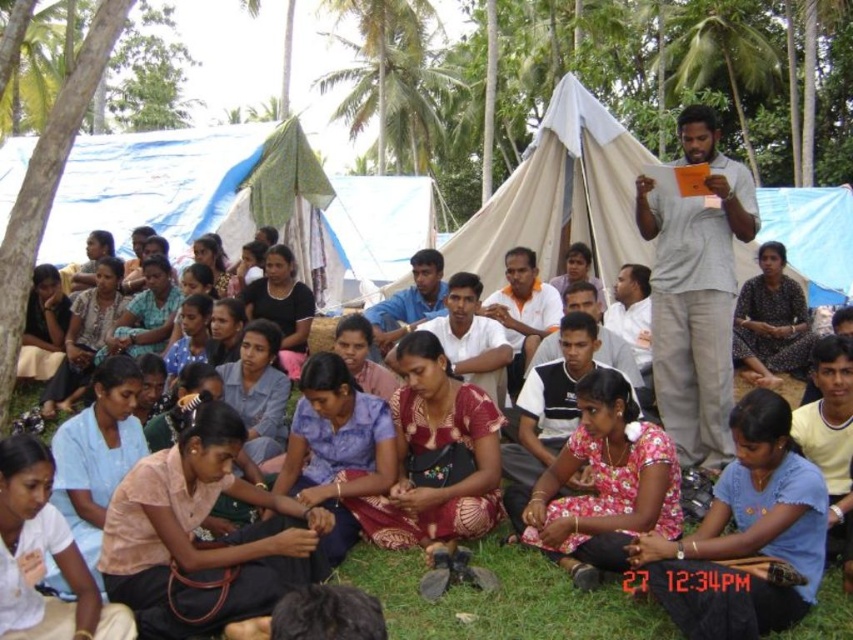
The width and height of the screenshot is (853, 640). What are the coordinates of `blue tarpaulin tent at upper left` in the screenshot? It's located at (201, 193).

Is blue tarpaulin tent at upper left smaller than white canvas tent at center?

Yes.

Is point (315, 243) closer to viewer compared to point (451, 253)?

No, (315, 243) is behind (451, 253).

You are a GUI agent. You are given a task and a screenshot of the screen. Output one action in this format:
    pyautogui.click(x=<x>, y=<y>)
    Task: Click on the blue tarpaulin tent at upper left
    The width and height of the screenshot is (853, 640).
    Given the screenshot: What is the action you would take?
    pyautogui.click(x=201, y=193)

Does point (608, 196) come farther from viewer compared to point (604, 493)?

Yes, it is.

Which is more to the left, white canvas tent at center or floral fabric dress at center?

floral fabric dress at center

Image resolution: width=853 pixels, height=640 pixels. What do you see at coordinates (560, 196) in the screenshot?
I see `white canvas tent at center` at bounding box center [560, 196].

Where is `white canvas tent at center`? Image resolution: width=853 pixels, height=640 pixels. white canvas tent at center is located at coordinates (560, 196).

Is point (735, 243) positioned behind point (648, 550)?

Yes.

Is white canvas tent at center bigger than floral fabric dress at lower center?

Yes, white canvas tent at center is bigger than floral fabric dress at lower center.

The height and width of the screenshot is (640, 853). I want to click on white canvas tent at center, so point(560,196).